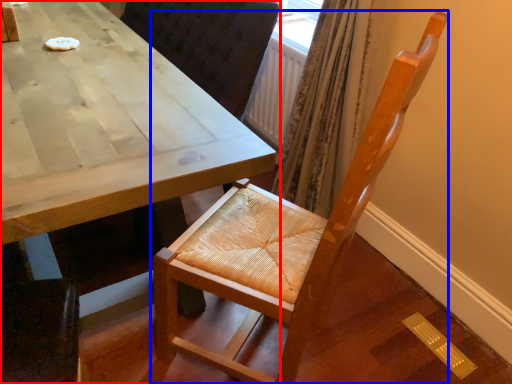
Question: Which of the following is the farthest to the observer, table (highlighted by a red box) or chair (highlighted by a blue box)?

Choices:
 (A) table
 (B) chair

Answer: (A)